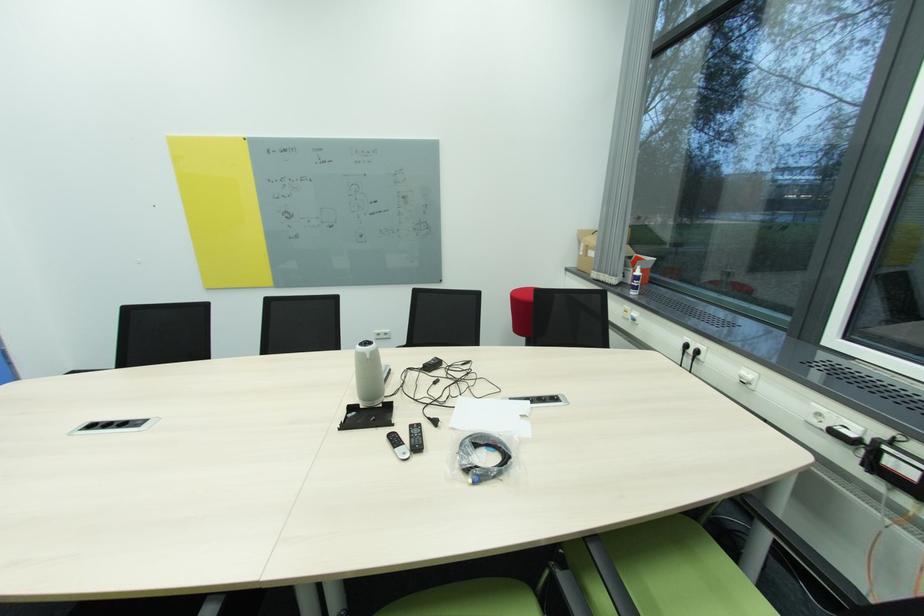
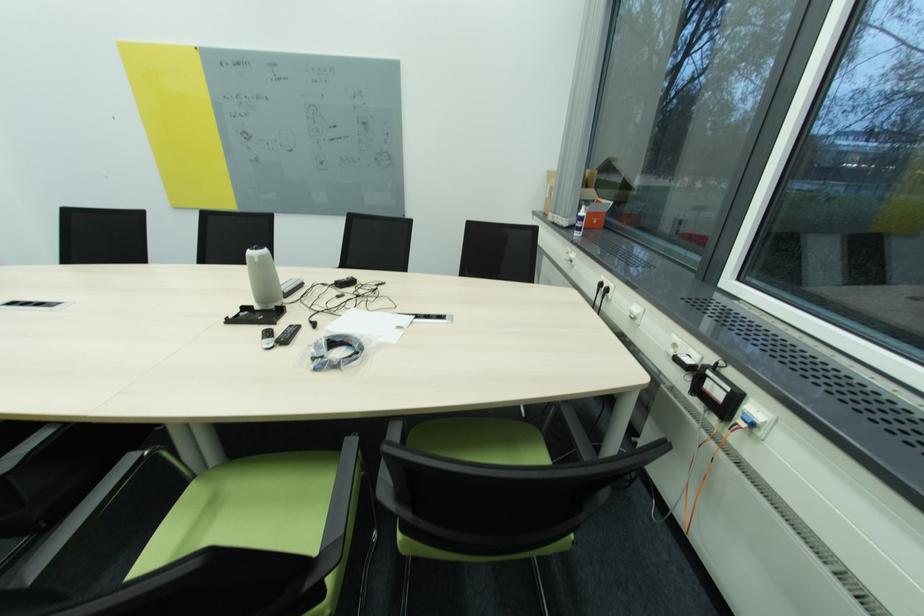
The point at (824, 416) is marked in the first image. Where is the corresponding point in the second image?

(679, 346)